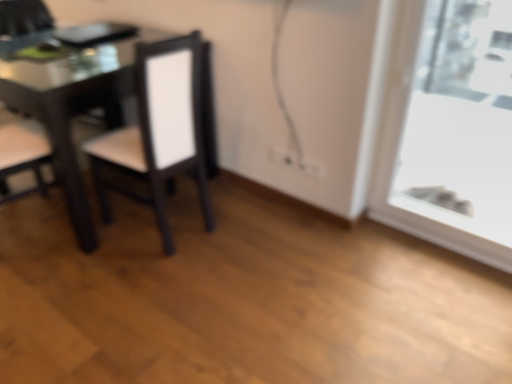
Question: Is transparent glass window at right bigger than matte black chair at left, the first chair from the left?

Choices:
 (A) no
 (B) yes

Answer: (A)

Question: Is transparent glass window at right further to the viewer compared to matte black chair at left, which is the 2th chair in right-to-left order?

Choices:
 (A) no
 (B) yes

Answer: (A)

Question: Does transparent glass window at right have a greater width compared to matte black chair at left, the first chair from the left?

Choices:
 (A) yes
 (B) no

Answer: (B)

Question: Can you confirm if transparent glass window at right is smaller than matte black chair at left, which is the 2th chair in right-to-left order?

Choices:
 (A) yes
 (B) no

Answer: (A)

Question: Is transparent glass window at right oriented away from matte black chair at left, the first chair from the left?

Choices:
 (A) yes
 (B) no

Answer: (B)

Question: Considering the relative sizes of transparent glass window at right and matte black chair at left, the first chair from the left, in the image provided, is transparent glass window at right shorter than matte black chair at left, the first chair from the left,?

Choices:
 (A) no
 (B) yes

Answer: (A)

Question: Considering the relative positions of transparent glass window at right and matte black chair at center, the first chair from the right, in the image provided, is transparent glass window at right behind matte black chair at center, the first chair from the right,?

Choices:
 (A) no
 (B) yes

Answer: (A)

Question: From a real-world perspective, is transparent glass window at right physically below matte black chair at center, which ranks as the 2th chair in left-to-right order?

Choices:
 (A) no
 (B) yes

Answer: (A)

Question: Is transparent glass window at right positioned far away from matte black chair at center, which ranks as the 2th chair in left-to-right order?

Choices:
 (A) yes
 (B) no

Answer: (A)

Question: Does transparent glass window at right appear on the left side of matte black chair at center, which ranks as the 2th chair in left-to-right order?

Choices:
 (A) no
 (B) yes

Answer: (A)

Question: Is transparent glass window at right bigger than matte black chair at center, which ranks as the 2th chair in left-to-right order?

Choices:
 (A) no
 (B) yes

Answer: (A)

Question: Is transparent glass window at right at the right side of matte black chair at center, the first chair from the right?

Choices:
 (A) yes
 (B) no

Answer: (A)

Question: Can you confirm if matte black chair at left, which is the 2th chair in right-to-left order, is positioned to the left of transparent glass window at right?

Choices:
 (A) yes
 (B) no

Answer: (A)